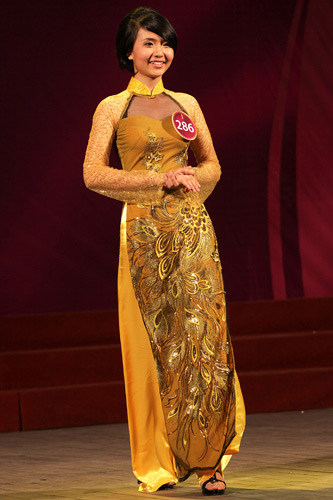
You are a GUI agent. You are given a task and a screenshot of the screen. Output one action in this format:
    pyautogui.click(x=<x>, y=<y>)
    Task: Click on the chest
    
    Given the screenshot: What is the action you would take?
    pyautogui.click(x=156, y=105)